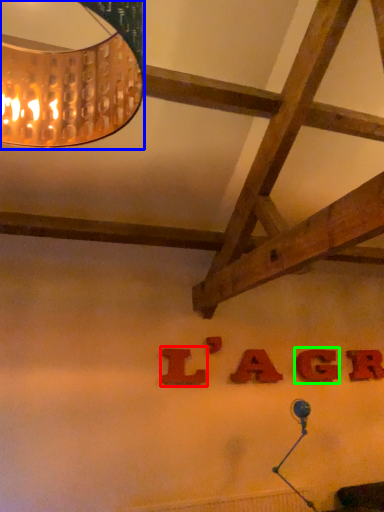
Question: Considering the real-world distances, which object is farthest from letter (highlighted by a red box)? lamp (highlighted by a blue box) or letter (highlighted by a green box)?

Choices:
 (A) lamp
 (B) letter

Answer: (A)